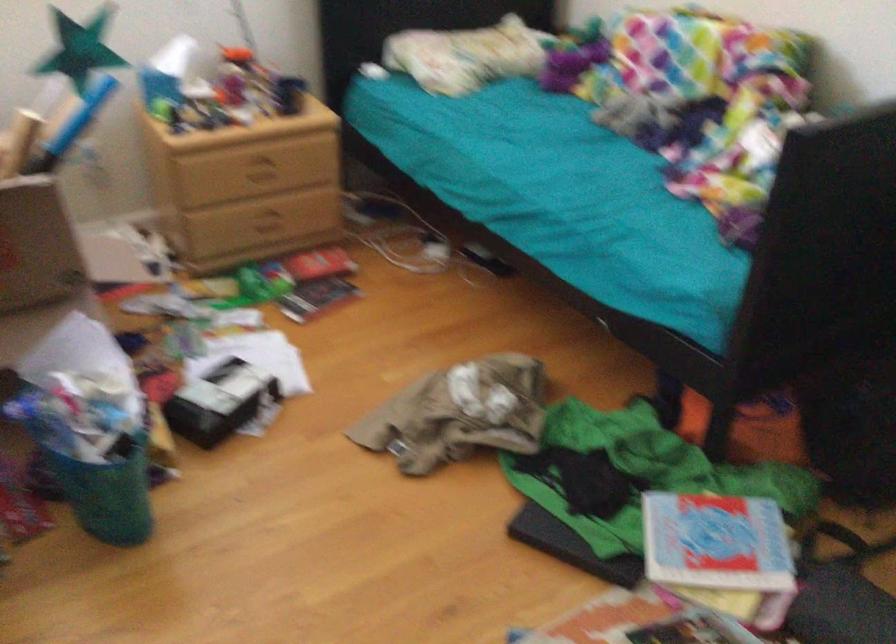
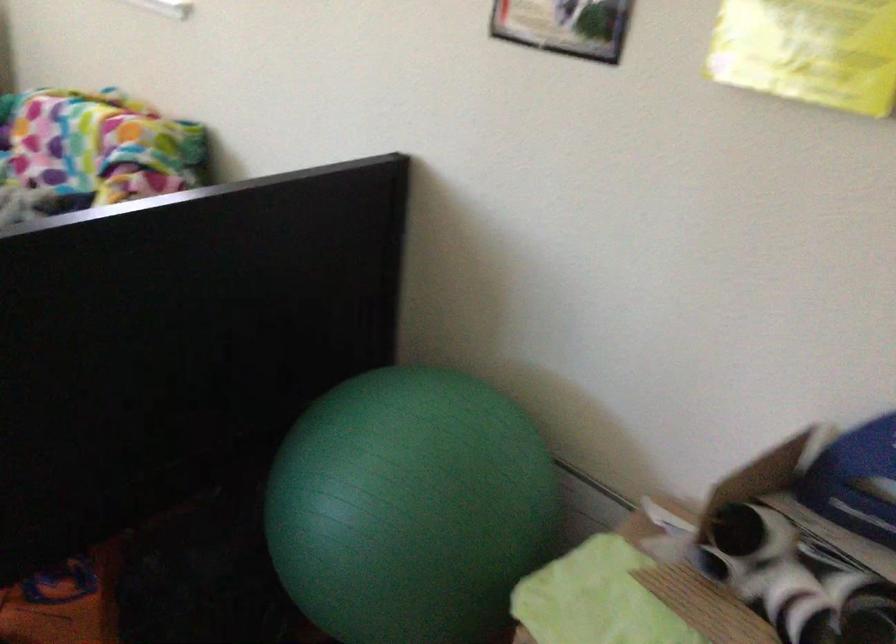
Question: The camera is either moving clockwise (left) or counter-clockwise (right) around the object. The first image is from the beginning of the video and the second image is from the end. Is the camera moving left or right when shooting the video?

Choices:
 (A) Left
 (B) Right

Answer: (A)